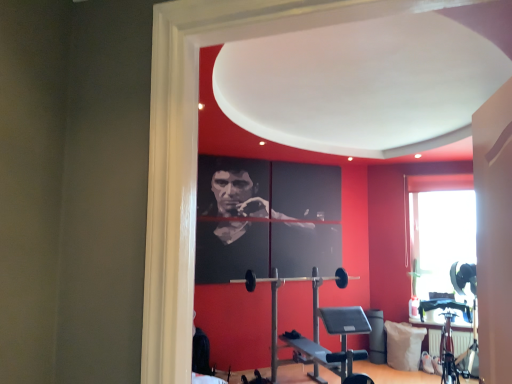
Question: Considering the relative positions of black rubber barbell at center and white fabric pillow at lower right in the image provided, is black rubber barbell at center to the left of white fabric pillow at lower right from the viewer's perspective?

Choices:
 (A) no
 (B) yes

Answer: (B)

Question: Can you confirm if black rubber barbell at center is thinner than white fabric pillow at lower right?

Choices:
 (A) no
 (B) yes

Answer: (B)

Question: From the image's perspective, is black rubber barbell at center located beneath white fabric pillow at lower right?

Choices:
 (A) yes
 (B) no

Answer: (B)

Question: Is black rubber barbell at center smaller than white fabric pillow at lower right?

Choices:
 (A) no
 (B) yes

Answer: (A)

Question: Is black rubber barbell at center oriented away from white fabric pillow at lower right?

Choices:
 (A) yes
 (B) no

Answer: (B)

Question: From a real-world perspective, is black rubber barbell at center physically above white fabric pillow at lower right?

Choices:
 (A) no
 (B) yes

Answer: (B)

Question: Does white fabric pillow at lower right have a lesser width compared to black rubber barbell at center?

Choices:
 (A) yes
 (B) no

Answer: (B)

Question: Is white fabric pillow at lower right outside black rubber barbell at center?

Choices:
 (A) no
 (B) yes

Answer: (B)

Question: Is white fabric pillow at lower right turned away from black rubber barbell at center?

Choices:
 (A) no
 (B) yes

Answer: (A)

Question: Does white fabric pillow at lower right appear on the left side of black rubber barbell at center?

Choices:
 (A) yes
 (B) no

Answer: (B)

Question: From the image's perspective, would you say white fabric pillow at lower right is positioned over black rubber barbell at center?

Choices:
 (A) no
 (B) yes

Answer: (A)

Question: Is white fabric pillow at lower right bigger than black rubber barbell at center?

Choices:
 (A) no
 (B) yes

Answer: (A)

Question: Is white fabric pillow at lower right situated inside black rubber barbell at center or outside?

Choices:
 (A) outside
 (B) inside

Answer: (A)